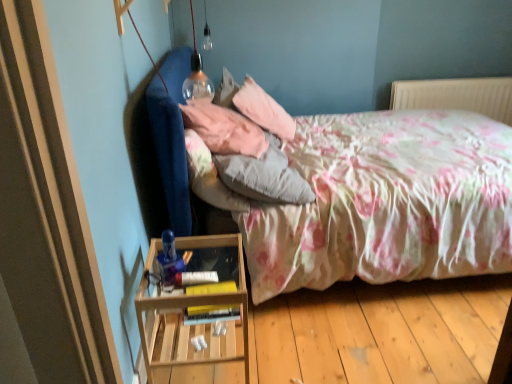
This screenshot has height=384, width=512. I want to click on fluffy white pillow at center, which ranks as the 3th pillow in back-to-front order, so click(x=264, y=176).

Describe the element at coordinates (264, 110) in the screenshot. I see `pink soft pillow at upper center, the 3th pillow in the front-to-back sequence` at that location.

This screenshot has width=512, height=384. Describe the element at coordinates (224, 129) in the screenshot. I see `pink fabric pillow at upper center, the 2th pillow in the front-to-back sequence` at that location.

In order to face white plastic radiator at upper right, should I rotate leftwards or rightwards?

Rotate your view right by about 25.416°.

Find the location of a particular element. The height and width of the screenshot is (384, 512). floral fabric bed at center is located at coordinates (364, 199).

Is wooden at left inside the boundaries of white plastic radiator at upper right, or outside?

wooden at left is spatially situated outside white plastic radiator at upper right.

Between wooden at left and white plastic radiator at upper right, which one has less height?

white plastic radiator at upper right.

Does wooden at left come behind white plastic radiator at upper right?

No, wooden at left is closer to the viewer.

In the image, is pink fabric pillow at upper center, the 2th pillow in the front-to-back sequence, positioned in front of or behind wooden at left?

pink fabric pillow at upper center, the 2th pillow in the front-to-back sequence, is behind wooden at left.

Is pink fabric pillow at upper center, the 2th pillow in the front-to-back sequence, far from wooden at left?

They are positioned close to each other.

Does pink fabric pillow at upper center, the 2th pillow in the back-to-front sequence, have a smaller size compared to wooden at left?

Yes.

Can you confirm if pink fabric pillow at upper center, the 2th pillow in the back-to-front sequence, is shorter than wooden at left?

Yes, pink fabric pillow at upper center, the 2th pillow in the back-to-front sequence, is shorter than wooden at left.

Can you see wooden at left touching floral fabric bed at center?

No, wooden at left is not in contact with floral fabric bed at center.

Between wooden at left and floral fabric bed at center, which one appears on the left side from the viewer's perspective?

Positioned to the left is wooden at left.

Considering the sizes of wooden at left and floral fabric bed at center in the image, is wooden at left wider or thinner than floral fabric bed at center?

In the image, wooden at left appears to be more narrow than floral fabric bed at center.

At what (x,y) coordinates should I click in order to perform the action: click on pillow that is the 1st one when counting forward from the white plastic radiator at upper right. Please return your answer as a coordinate pair (x, y). This screenshot has width=512, height=384. Looking at the image, I should click on (264, 110).

From the image's perspective, would you say white plastic radiator at upper right is positioned over pink soft pillow at upper center, the 3th pillow in the front-to-back sequence?

Yes, from the image's perspective, white plastic radiator at upper right is above pink soft pillow at upper center, the 3th pillow in the front-to-back sequence.

Is white plastic radiator at upper right oriented away from pink soft pillow at upper center, the 3th pillow in the front-to-back sequence?

No, white plastic radiator at upper right is not facing away from pink soft pillow at upper center, the 3th pillow in the front-to-back sequence.

In the image, is white plastic radiator at upper right on the left side or the right side of pink soft pillow at upper center, placed as the first pillow when sorted from back to front?

white plastic radiator at upper right is positioned on pink soft pillow at upper center, placed as the first pillow when sorted from back to front,'s right side.

What's the angular difference between white plastic radiator at upper right and fluffy white pillow at center, which is the first pillow in front-to-back order,'s facing directions?

The angular difference between white plastic radiator at upper right and fluffy white pillow at center, which is the first pillow in front-to-back order, is 98.6 degrees.

Is white plastic radiator at upper right situated inside fluffy white pillow at center, which ranks as the 3th pillow in back-to-front order, or outside?

white plastic radiator at upper right is located beyond the bounds of fluffy white pillow at center, which ranks as the 3th pillow in back-to-front order.

Which is more distant, (397, 99) or (251, 168)?

The point (397, 99) is farther.

Looking at this image, are white plastic radiator at upper right and fluffy white pillow at center, which ranks as the 3th pillow in back-to-front order, far apart?

Yes.

What are the coordinates of `radiator above the fluffy white pillow at center, which is the first pillow in front-to-back order (from the image's perspective)` in the screenshot? It's located at (456, 96).

Are fluffy white pillow at center, which ranks as the 3th pillow in back-to-front order, and white plastic radiator at upper right far apart?

Yes, fluffy white pillow at center, which ranks as the 3th pillow in back-to-front order, and white plastic radiator at upper right are quite far apart.

Can you confirm if fluffy white pillow at center, which is the first pillow in front-to-back order, is shorter than white plastic radiator at upper right?

Yes, fluffy white pillow at center, which is the first pillow in front-to-back order, is shorter than white plastic radiator at upper right.

From the image's perspective, is fluffy white pillow at center, which is the first pillow in front-to-back order, located beneath white plastic radiator at upper right?

Yes, from the image's perspective, fluffy white pillow at center, which is the first pillow in front-to-back order, is beneath white plastic radiator at upper right.

Is wooden at left wider or thinner than pink fabric pillow at upper center, the 2th pillow in the back-to-front sequence?

In the image, wooden at left appears to be more narrow than pink fabric pillow at upper center, the 2th pillow in the back-to-front sequence.

From the image's perspective, is wooden at left beneath pink fabric pillow at upper center, the 2th pillow in the back-to-front sequence?

Yes, from the image's perspective, wooden at left is below pink fabric pillow at upper center, the 2th pillow in the back-to-front sequence.

Is point (239, 276) closer or farther from the camera than point (220, 145)?

Point (239, 276) is positioned closer to the camera compared to point (220, 145).

At what (x,y) coordinates should I click in order to perform the action: click on radiator that is above the wooden at left (from the image's perspective). Please return your answer as a coordinate pair (x, y). Looking at the image, I should click on (456, 96).

What are the coordinates of `nightstand below the pink fabric pillow at upper center, the 2th pillow in the front-to-back sequence (from a real-world perspective)` in the screenshot? It's located at (192, 326).

Considering their positions, is wooden at left positioned closer to pink soft pillow at upper center, the 3th pillow in the front-to-back sequence, than pink fabric pillow at upper center, the 2th pillow in the back-to-front sequence?

pink fabric pillow at upper center, the 2th pillow in the back-to-front sequence, is positioned closer to the anchor pink soft pillow at upper center, the 3th pillow in the front-to-back sequence.

Looking at the image, which one is located closer to white plastic radiator at upper right, wooden at left or pink soft pillow at upper center, the 3th pillow in the front-to-back sequence?

pink soft pillow at upper center, the 3th pillow in the front-to-back sequence, lies closer to white plastic radiator at upper right than the other object.

Estimate the real-world distances between objects in this image. Which object is further from fluffy white pillow at center, which ranks as the 3th pillow in back-to-front order, floral fabric bed at center or white plastic radiator at upper right?

white plastic radiator at upper right is further to fluffy white pillow at center, which ranks as the 3th pillow in back-to-front order.

Looking at the image, which one is located further to pink fabric pillow at upper center, the 2th pillow in the back-to-front sequence, white plastic radiator at upper right or fluffy white pillow at center, which ranks as the 3th pillow in back-to-front order?

white plastic radiator at upper right is positioned further to the anchor pink fabric pillow at upper center, the 2th pillow in the back-to-front sequence.

Which object lies further to the anchor point wooden at left, fluffy white pillow at center, which ranks as the 3th pillow in back-to-front order, or pink soft pillow at upper center, the 3th pillow in the front-to-back sequence?

Based on the image, pink soft pillow at upper center, the 3th pillow in the front-to-back sequence, appears to be further to wooden at left.

When comparing their distances from pink soft pillow at upper center, placed as the first pillow when sorted from back to front, does fluffy white pillow at center, which is the first pillow in front-to-back order, or pink fabric pillow at upper center, the 2th pillow in the back-to-front sequence, seem closer?

The object closer to pink soft pillow at upper center, placed as the first pillow when sorted from back to front, is pink fabric pillow at upper center, the 2th pillow in the back-to-front sequence.

Estimate the real-world distances between objects in this image. Which object is further from pink fabric pillow at upper center, the 2th pillow in the front-to-back sequence, pink soft pillow at upper center, the 3th pillow in the front-to-back sequence, or wooden at left?

Among the two, wooden at left is located further to pink fabric pillow at upper center, the 2th pillow in the front-to-back sequence.

Estimate the real-world distances between objects in this image. Which object is further from floral fabric bed at center, wooden at left or fluffy white pillow at center, which ranks as the 3th pillow in back-to-front order?

Among the two, wooden at left is located further to floral fabric bed at center.

Identify the location of bed between wooden at left and white plastic radiator at upper right in the front-back direction. (364, 199).

You are a GUI agent. You are given a task and a screenshot of the screen. Output one action in this format:
    pyautogui.click(x=<x>, y=<y>)
    Task: Click on the pillow between pink fabric pillow at upper center, the 2th pillow in the back-to-front sequence, and wooden at left from top to bottom
    The height and width of the screenshot is (384, 512).
    Given the screenshot: What is the action you would take?
    pyautogui.click(x=264, y=176)

The height and width of the screenshot is (384, 512). What are the coordinates of `pillow between fluffy white pillow at center, which is the first pillow in front-to-back order, and white plastic radiator at upper right` in the screenshot? It's located at (264, 110).

Where is `bed between wooden at left and pink soft pillow at upper center, placed as the first pillow when sorted from back to front, along the z-axis`? This screenshot has width=512, height=384. bed between wooden at left and pink soft pillow at upper center, placed as the first pillow when sorted from back to front, along the z-axis is located at coordinates (364, 199).